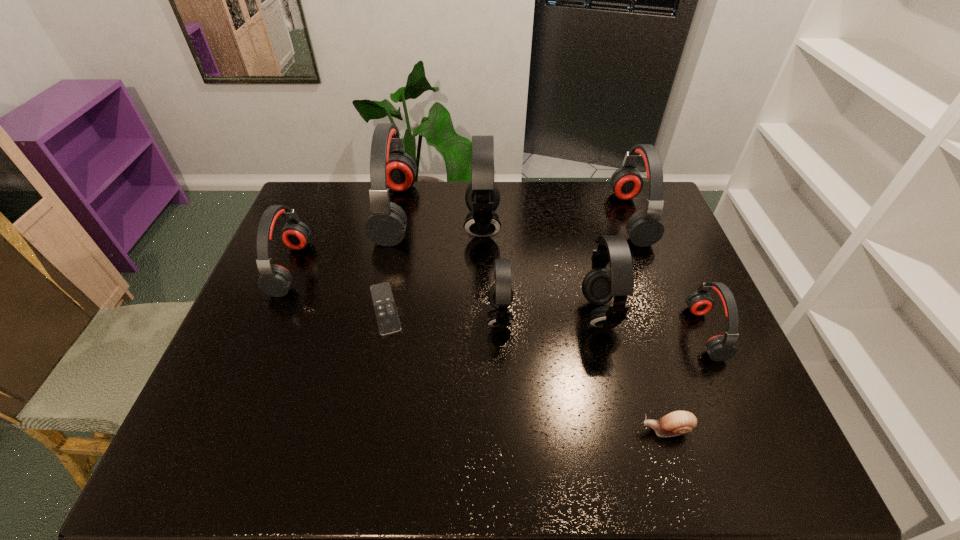
Find the location of a particular element. Image resolution: width=960 pixels, height=540 pixels. vacant area situated on the ear cups of the nearest red earphone is located at coordinates (601, 333).

Find the location of a particular element. free location located on the front-facing side of the escargot is located at coordinates (525, 430).

This screenshot has height=540, width=960. In order to click on vacant area located on the front-facing side of the escargot in this screenshot , I will do `click(589, 430)`.

Locate an element on the screen. This screenshot has height=540, width=960. free space located on the front-facing side of the escargot is located at coordinates (461, 430).

In order to click on vacant space located on the right of the remote control in this screenshot , I will do `click(449, 309)`.

This screenshot has height=540, width=960. What are the coordinates of `object situated at the near edge` in the screenshot? It's located at (675, 423).

Where is `object that is at the left edge`? object that is at the left edge is located at coordinates (275, 280).

Image resolution: width=960 pixels, height=540 pixels. What are the coordinates of `object that is at the far right corner` in the screenshot? It's located at (645, 228).

In order to click on free space at the far edge of the desktop in this screenshot , I will do `click(439, 205)`.

Find the location of `vacant space at the near edge`. vacant space at the near edge is located at coordinates (545, 441).